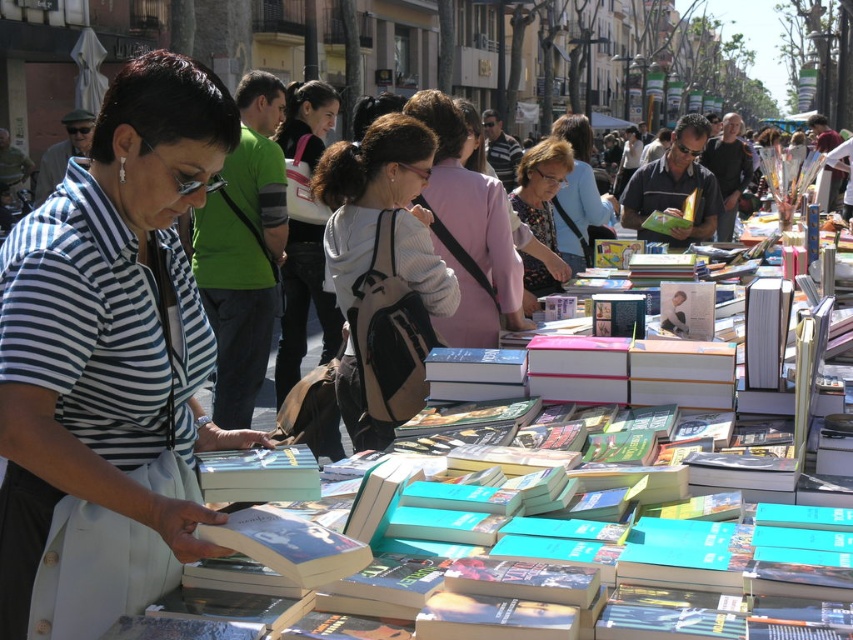
You are a vendor at the book market and need to make space for a new shipment. You notice the striped fabric shirt at center and the matte green book at center. Which item should you remove first to free up more space?

The striped fabric shirt at center occupies less space than the matte green book at center, so removing the matte green book at center will free up more space.

Based on the photo, you are a customer at the outdoor book market. You see the matte green book at center. What are its coordinates?

The coordinates of the matte green book at center are at point (675, 186).